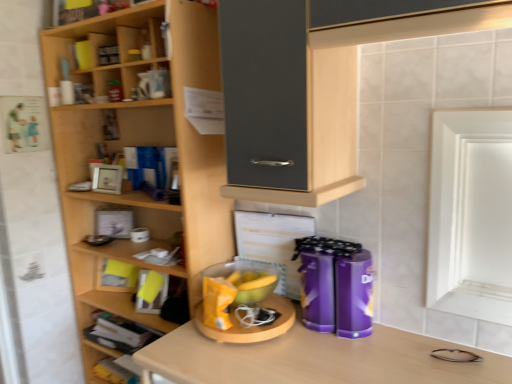
Question: Does wooden shelves at left, the third shelf positioned from the bottom, appear on the left side of yellow matte bowl at center, the second appliance when ordered from right to left?

Choices:
 (A) no
 (B) yes

Answer: (B)

Question: Can you confirm if wooden shelves at left, the third shelf positioned from the bottom, is taller than yellow matte bowl at center, the 1th appliance in the left-to-right sequence?

Choices:
 (A) yes
 (B) no

Answer: (A)

Question: Can we say wooden shelves at left, arranged as the 1th shelf when viewed from the top, lies outside yellow matte bowl at center, the 1th appliance in the left-to-right sequence?

Choices:
 (A) yes
 (B) no

Answer: (A)

Question: Is wooden shelves at left, arranged as the 1th shelf when viewed from the top, behind yellow matte bowl at center, the 1th appliance in the left-to-right sequence?

Choices:
 (A) no
 (B) yes

Answer: (A)

Question: Considering the relative sizes of wooden shelves at left, the third shelf positioned from the bottom, and yellow matte bowl at center, the 1th appliance in the left-to-right sequence, in the image provided, is wooden shelves at left, the third shelf positioned from the bottom, bigger than yellow matte bowl at center, the 1th appliance in the left-to-right sequence,?

Choices:
 (A) yes
 (B) no

Answer: (A)

Question: Considering the positions of purple glossy canisters at center, arranged as the first appliance when viewed from the right, and wooden shelf at lower left, which is the 1th shelf from bottom to top, in the image, is purple glossy canisters at center, arranged as the first appliance when viewed from the right, taller or shorter than wooden shelf at lower left, which is the 1th shelf from bottom to top,?

Choices:
 (A) short
 (B) tall

Answer: (B)

Question: Is purple glossy canisters at center, placed as the second appliance when sorted from left to right, inside or outside of wooden shelf at lower left, which is the 1th shelf from bottom to top?

Choices:
 (A) outside
 (B) inside

Answer: (A)

Question: Is point (302, 266) closer or farther from the camera than point (106, 382)?

Choices:
 (A) closer
 (B) farther

Answer: (A)

Question: From a real-world perspective, is purple glossy canisters at center, arranged as the first appliance when viewed from the right, positioned above or below wooden shelf at lower left, which is the 1th shelf from bottom to top?

Choices:
 (A) below
 (B) above

Answer: (B)

Question: From the image's perspective, is purple glossy canisters at center, placed as the second appliance when sorted from left to right, located above or below wooden shelves at left, the third shelf positioned from the bottom?

Choices:
 (A) above
 (B) below

Answer: (B)

Question: In the image, is purple glossy canisters at center, arranged as the first appliance when viewed from the right, positioned in front of or behind wooden shelves at left, the third shelf positioned from the bottom?

Choices:
 (A) front
 (B) behind

Answer: (A)

Question: Choose the correct answer: Is purple glossy canisters at center, placed as the second appliance when sorted from left to right, inside wooden shelves at left, arranged as the 1th shelf when viewed from the top, or outside it?

Choices:
 (A) inside
 (B) outside

Answer: (B)

Question: From a real-world perspective, relative to wooden shelves at left, the third shelf positioned from the bottom, is purple glossy canisters at center, placed as the second appliance when sorted from left to right, vertically above or below?

Choices:
 (A) above
 (B) below

Answer: (B)

Question: From a real-world perspective, is wooden shelf at lower left, which is the 1th shelf from bottom to top, positioned above or below wooden books at lower left, which ranks as the 2th shelf in top-to-bottom order?

Choices:
 (A) below
 (B) above

Answer: (A)

Question: Which is correct: wooden shelf at lower left, which is the 1th shelf from bottom to top, is inside wooden books at lower left, the second shelf positioned from the bottom, or outside of it?

Choices:
 (A) inside
 (B) outside

Answer: (B)